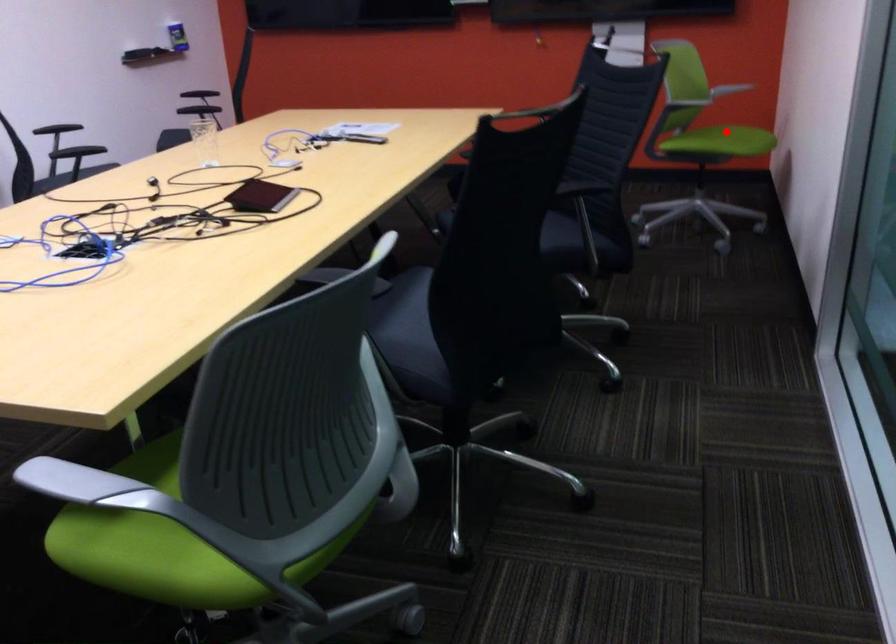
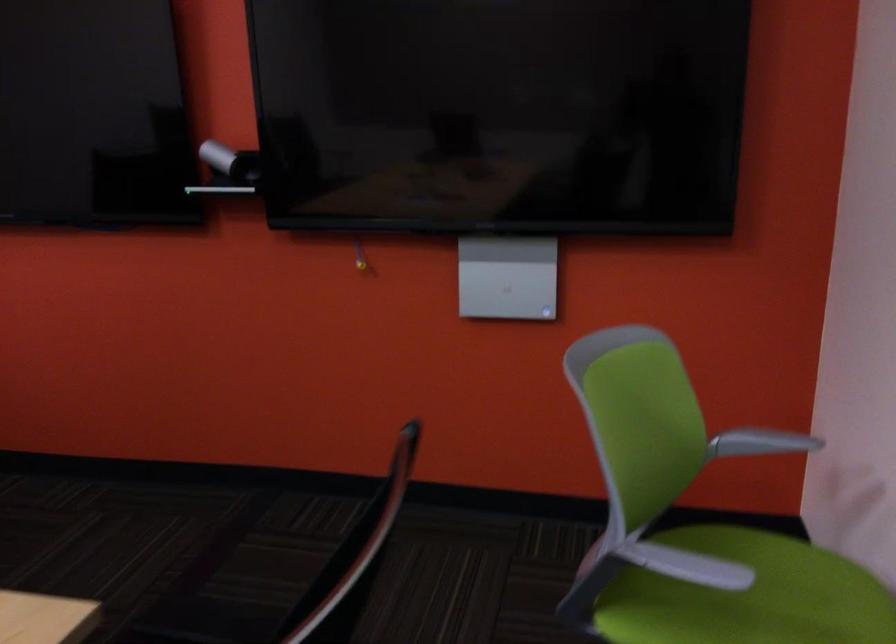
Question: I am providing you with two images of the same scene from different viewpoints. Image1 has a red point marked. In image2, the corresponding 3D location appears at what relative position? Reply with the corresponding letter.

Choices:
 (A) Closer
 (B) Farther

Answer: (A)